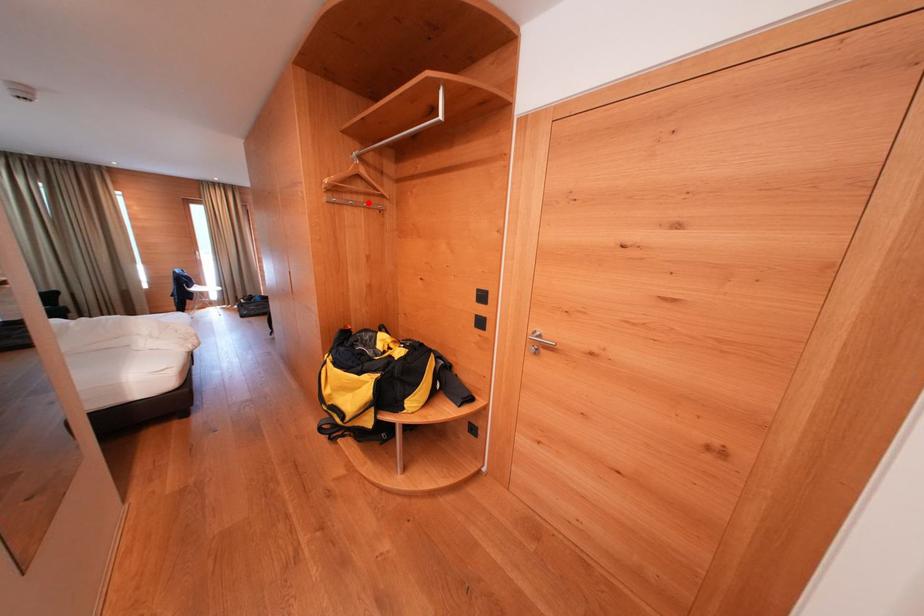
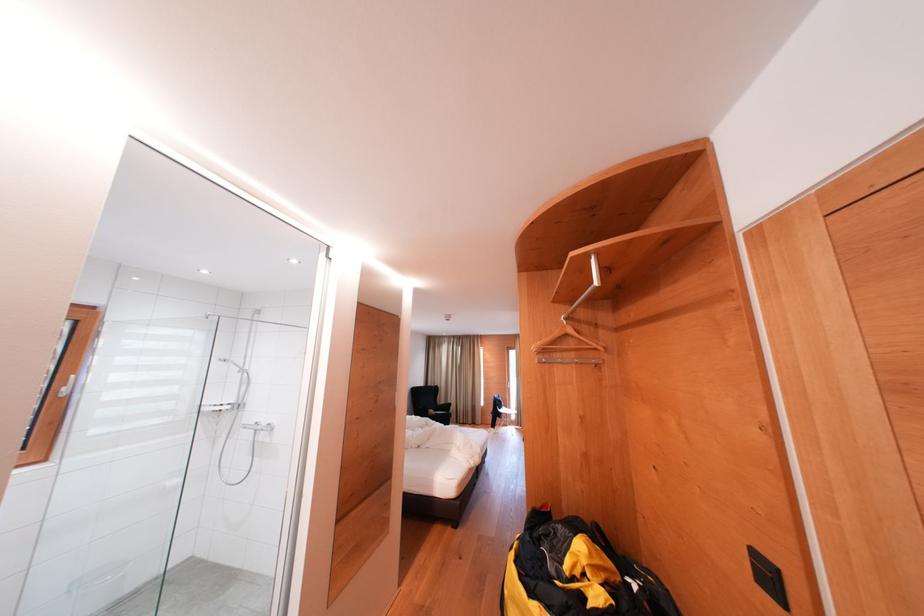
Question: I am providing you with two images of the same scene from different viewpoints. Given a red point in image1, look at the same physical point in image2. Is it:

Choices:
 (A) Closer to the viewpoint
 (B) Farther from the viewpoint

Answer: (B)